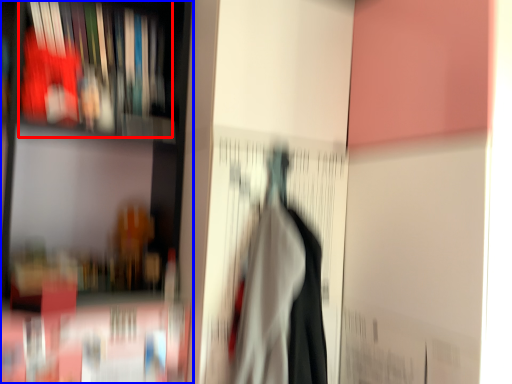
Question: Which point is closer to the camera, book (highlighted by a red box) or shelf (highlighted by a blue box)?

Choices:
 (A) book
 (B) shelf

Answer: (B)